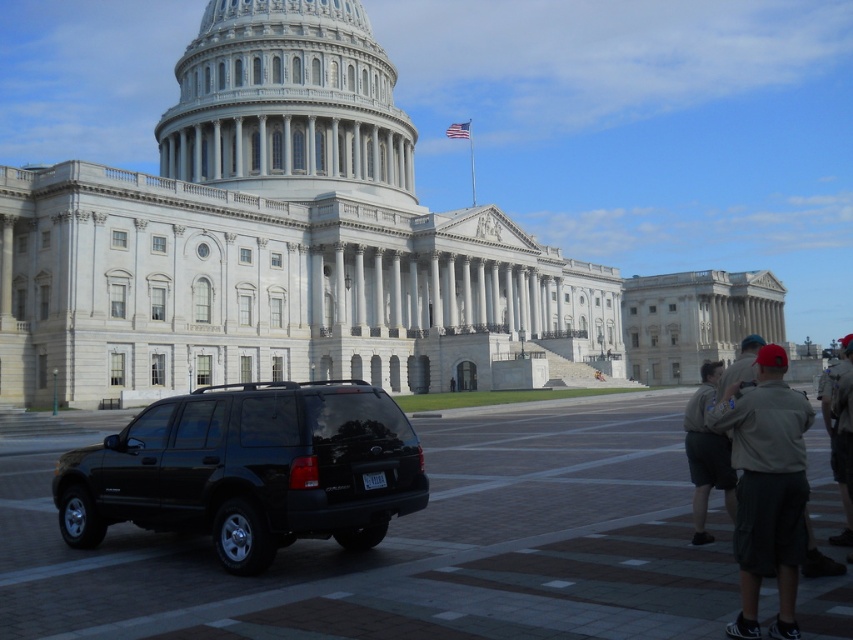
You are a tour guide explaining the layout of the Capitol grounds. You mention the black matte suv at center and the khaki shorts at lower right. Which object takes up more horizontal space in the image?

The khaki shorts at lower right takes up more horizontal space than the black matte suv at center because the suv at center is narrower than the khaki shorts at lower right.

Where is the khaki shorts at lower right located in the image?

The khaki shorts at lower right is located at the 2D coordinate point of [706,452].

You are a photographer positioned at the center of the plaza facing the Capitol building. You notice two items at the lower right corner of your viewfinder. One is labeled as khaki shorts at lower right and the other as khaki uniform at lower right. Which of these items appears shorter in your view?

The khaki shorts at lower right appears shorter than the khaki uniform at lower right because it is not as tall as the khaki uniform at lower right.